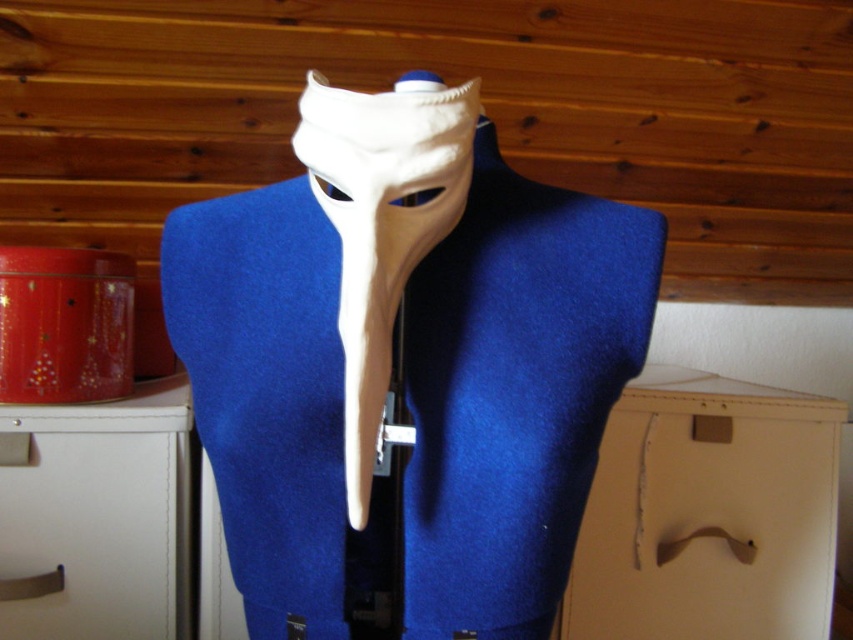
Looking at this image, you are organizing a fashion exhibition and need to place the beige cardboard drawer at lower right and the white matte mask at center on a shelf. Given their sizes, which object should be placed first to ensure stability?

The beige cardboard drawer at lower right has a lesser height compared to the white matte mask at center, so it should be placed first on the lower shelf to ensure stability.

You are an interior designer trying to arrange items in a room. You have a beige cardboard drawer at lower right and a white matte mask at center. If the minimum distance required between these items for aesthetic balance is 60 centimeters, will the current placement meet this requirement?

The beige cardboard drawer at lower right is 62.70 centimeters from the white matte mask at center, which exceeds the 60 centimeter requirement, so the current placement meets the aesthetic balance requirement.

You are an interior designer assessing the placement of objects in the room. You see the white matte mask at center and the white matte drawer at lower left. Which object takes up more vertical space in the scene?

The white matte mask at center is much taller than the white matte drawer at lower left, so it takes up more vertical space in the scene.